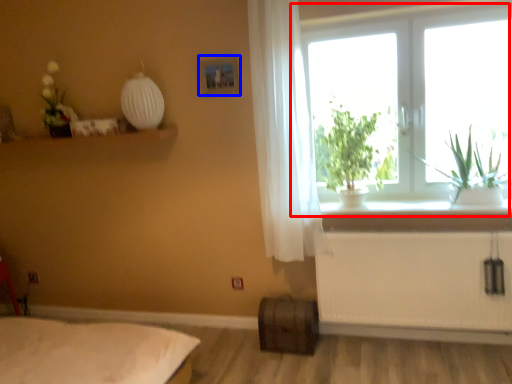
Question: Which object appears closest to the camera in this image, window (highlighted by a red box) or picture frame (highlighted by a blue box)?

Choices:
 (A) window
 (B) picture frame

Answer: (A)